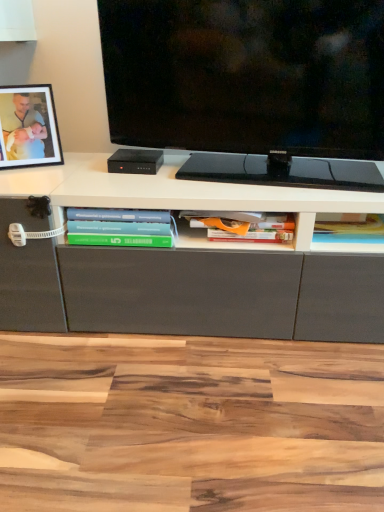
The height and width of the screenshot is (512, 384). Describe the element at coordinates (242, 226) in the screenshot. I see `orange matte book at center, the second book from the right` at that location.

Describe the element at coordinates (250, 85) in the screenshot. I see `black glossy tv at center` at that location.

Measure the distance between point (85, 236) and camera.

The depth of point (85, 236) is 3.39 feet.

Locate an element on the screen. The width and height of the screenshot is (384, 512). orange matte book at center, the second book from the right is located at coordinates (242, 226).

Is point (133, 223) more distant than point (364, 247)?

No, (133, 223) is in front of (364, 247).

Between green matte book at lower left, which is the 1th book from left to right, and hardcover book at center, which is the first book from right to left, which one has smaller size?

With smaller size is hardcover book at center, which is the first book from right to left.

From the picture: Is green matte book at lower left, which is the 1th book from left to right, to the right of hardcover book at center, which is the first book from right to left, from the viewer's perspective?

Incorrect, green matte book at lower left, which is the 1th book from left to right, is not on the right side of hardcover book at center, which is the first book from right to left.

Is green matte book at lower left, which is the 1th book from left to right, oriented towards hardcover book at center, the third book positioned from the left?

No, green matte book at lower left, which is the 1th book from left to right, does not turn towards hardcover book at center, the third book positioned from the left.

From the image's perspective, is black matte picture frame at upper left below green matte book at lower left, marked as the 3th book in a right-to-left arrangement?

No.

Considering the sizes of objects black matte picture frame at upper left and green matte book at lower left, marked as the 3th book in a right-to-left arrangement, in the image provided, who is bigger, black matte picture frame at upper left or green matte book at lower left, marked as the 3th book in a right-to-left arrangement,?

With larger size is black matte picture frame at upper left.

Is black matte picture frame at upper left to the left or to the right of green matte book at lower left, marked as the 3th book in a right-to-left arrangement, in the image?

black matte picture frame at upper left is to the left of green matte book at lower left, marked as the 3th book in a right-to-left arrangement.

From a real-world perspective, between green matte book at lower left, which is the 1th book from left to right, and orange matte book at center, which ranks as the 2th book in left-to-right order, who is vertically higher?

From a 3D spatial view, green matte book at lower left, which is the 1th book from left to right, is above.

Considering the relative sizes of green matte book at lower left, marked as the 3th book in a right-to-left arrangement, and orange matte book at center, which ranks as the 2th book in left-to-right order, in the image provided, is green matte book at lower left, marked as the 3th book in a right-to-left arrangement, taller than orange matte book at center, which ranks as the 2th book in left-to-right order,?

Correct, green matte book at lower left, marked as the 3th book in a right-to-left arrangement, is much taller as orange matte book at center, which ranks as the 2th book in left-to-right order.

Is green matte book at lower left, which is the 1th book from left to right, thinner than orange matte book at center, the second book from the right?

Incorrect, the width of green matte book at lower left, which is the 1th book from left to right, is not less than that of orange matte book at center, the second book from the right.

Is green matte book at lower left, marked as the 3th book in a right-to-left arrangement, bigger than orange matte book at center, the second book from the right?

Yes.

I want to click on television that appears above the green matte book at lower left, marked as the 3th book in a right-to-left arrangement (from the image's perspective), so click(250, 85).

From the picture: Is black glossy tv at center wider or thinner than green matte book at lower left, marked as the 3th book in a right-to-left arrangement?

In the image, black glossy tv at center appears to be more narrow than green matte book at lower left, marked as the 3th book in a right-to-left arrangement.

Between black glossy tv at center and green matte book at lower left, marked as the 3th book in a right-to-left arrangement, which one has less height?

Standing shorter between the two is green matte book at lower left, marked as the 3th book in a right-to-left arrangement.

How many degrees apart are the facing directions of black glossy tv at center and green matte book at lower left, which is the 1th book from left to right?

There is a 9.69-degree angle between the facing directions of black glossy tv at center and green matte book at lower left, which is the 1th book from left to right.

Is point (374, 238) more distant than point (55, 143)?

No, it is in front of (55, 143).

Is hardcover book at center, which is the first book from right to left, not near black matte picture frame at upper left?

They are positioned close to each other.

From the image's perspective, which one is positioned lower, hardcover book at center, the third book positioned from the left, or black matte picture frame at upper left?

From the image's view, hardcover book at center, the third book positioned from the left, is below.

Which of these two, hardcover book at center, the third book positioned from the left, or black matte picture frame at upper left, is thinner?

Thinner between the two is black matte picture frame at upper left.

From the picture: Do you think green matte book at lower left, marked as the 3th book in a right-to-left arrangement, is within black matte picture frame at upper left, or outside of it?

green matte book at lower left, marked as the 3th book in a right-to-left arrangement, is located beyond the bounds of black matte picture frame at upper left.

Consider the image. From the image's perspective, which is below, green matte book at lower left, marked as the 3th book in a right-to-left arrangement, or black matte picture frame at upper left?

From the image's view, green matte book at lower left, marked as the 3th book in a right-to-left arrangement, is below.

How different are the orientations of green matte book at lower left, which is the 1th book from left to right, and black matte picture frame at upper left in degrees?

The angular difference between green matte book at lower left, which is the 1th book from left to right, and black matte picture frame at upper left is 24.4 degrees.

From their relative heights in the image, would you say green matte book at lower left, which is the 1th book from left to right, is taller or shorter than black matte picture frame at upper left?

Considering their sizes, green matte book at lower left, which is the 1th book from left to right, has less height than black matte picture frame at upper left.

Which point is more forward, (x=286, y=154) or (x=10, y=150)?

The point (x=286, y=154) is closer.

From their relative heights in the image, would you say black glossy tv at center is taller or shorter than black matte picture frame at upper left?

black glossy tv at center is taller than black matte picture frame at upper left.

Where is `the 1st book below the green matte book at lower left, marked as the 3th book in a right-to-left arrangement (from the image's perspective)`? the 1st book below the green matte book at lower left, marked as the 3th book in a right-to-left arrangement (from the image's perspective) is located at coordinates (350, 234).

Find the location of `the 2nd book in front of the black matte picture frame at upper left`. the 2nd book in front of the black matte picture frame at upper left is located at coordinates (119, 227).

Looking at the image, which one is located closer to black glossy tv at center, hardcover book at center, the third book positioned from the left, or green matte book at lower left, marked as the 3th book in a right-to-left arrangement?

Among the two, hardcover book at center, the third book positioned from the left, is located nearer to black glossy tv at center.

Which object lies nearer to the anchor point green matte book at lower left, marked as the 3th book in a right-to-left arrangement, black matte picture frame at upper left or black glossy tv at center?

black matte picture frame at upper left lies closer to green matte book at lower left, marked as the 3th book in a right-to-left arrangement, than the other object.

Estimate the real-world distances between objects in this image. Which object is closer to green matte book at lower left, marked as the 3th book in a right-to-left arrangement, hardcover book at center, which is the first book from right to left, or black matte picture frame at upper left?

Among the two, black matte picture frame at upper left is located nearer to green matte book at lower left, marked as the 3th book in a right-to-left arrangement.

Estimate the real-world distances between objects in this image. Which object is closer to black glossy tv at center, orange matte book at center, the second book from the right, or green matte book at lower left, which is the 1th book from left to right?

orange matte book at center, the second book from the right, is positioned closer to the anchor black glossy tv at center.

From the image, which object appears to be nearer to black glossy tv at center, hardcover book at center, which is the first book from right to left, or black matte picture frame at upper left?

Among the two, hardcover book at center, which is the first book from right to left, is located nearer to black glossy tv at center.

Estimate the real-world distances between objects in this image. Which object is closer to black matte picture frame at upper left, orange matte book at center, which ranks as the 2th book in left-to-right order, or hardcover book at center, the third book positioned from the left?

orange matte book at center, which ranks as the 2th book in left-to-right order.

When comparing their distances from black glossy tv at center, does hardcover book at center, the third book positioned from the left, or orange matte book at center, which ranks as the 2th book in left-to-right order, seem closer?

orange matte book at center, which ranks as the 2th book in left-to-right order.

Looking at the image, which one is located further to green matte book at lower left, marked as the 3th book in a right-to-left arrangement, orange matte book at center, the second book from the right, or black matte picture frame at upper left?

Among the two, black matte picture frame at upper left is located further to green matte book at lower left, marked as the 3th book in a right-to-left arrangement.

What are the coordinates of `book between black matte picture frame at upper left and black glossy tv at center` in the screenshot? It's located at (119, 227).

The image size is (384, 512). In order to click on television situated between black matte picture frame at upper left and orange matte book at center, which ranks as the 2th book in left-to-right order, from left to right in this screenshot , I will do `click(250, 85)`.

You are a GUI agent. You are given a task and a screenshot of the screen. Output one action in this format:
    pyautogui.click(x=<x>, y=<y>)
    Task: Click on the book located between green matte book at lower left, which is the 1th book from left to right, and hardcover book at center, which is the first book from right to left, in the left-right direction
    This screenshot has width=384, height=512.
    Given the screenshot: What is the action you would take?
    pyautogui.click(x=242, y=226)

Locate an element on the screen. television between green matte book at lower left, marked as the 3th book in a right-to-left arrangement, and hardcover book at center, which is the first book from right to left is located at coordinates (250, 85).